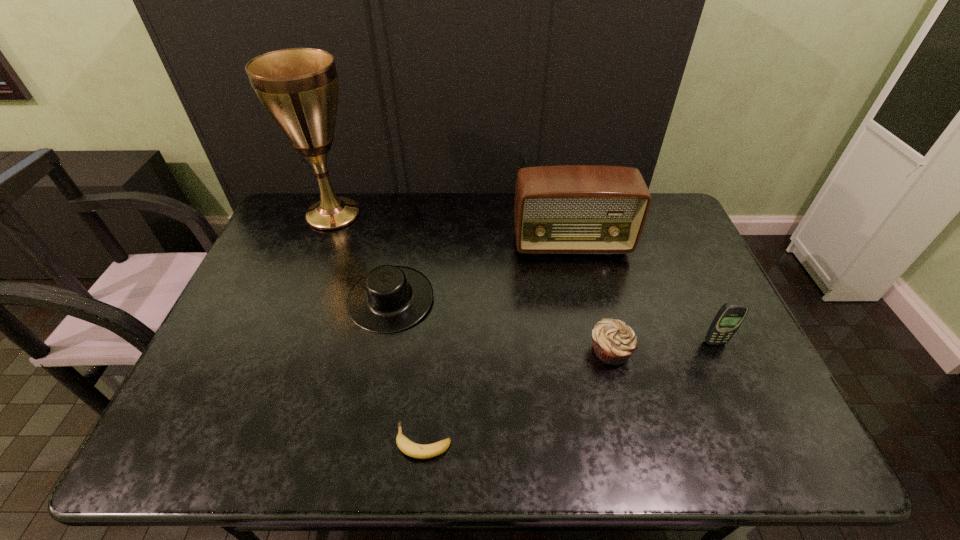
Locate an element on the screen. Image resolution: width=960 pixels, height=540 pixels. vacant region between the muffin and the dress hat is located at coordinates (500, 325).

This screenshot has width=960, height=540. Identify the location of free space between the dress hat and the muffin. (500, 325).

Locate an element on the screen. empty space that is in between the trophy cup and the muffin is located at coordinates 471,282.

Identify the location of unoccupied position between the rightmost object and the radio receiver. The image size is (960, 540). (643, 293).

At what (x,y) coordinates should I click in order to perform the action: click on the fifth closest object to the shortest object. Please return your answer as a coordinate pair (x, y). Looking at the image, I should click on (298, 87).

Identify the location of object that is the fourth closest one to the dress hat. The image size is (960, 540). (614, 341).